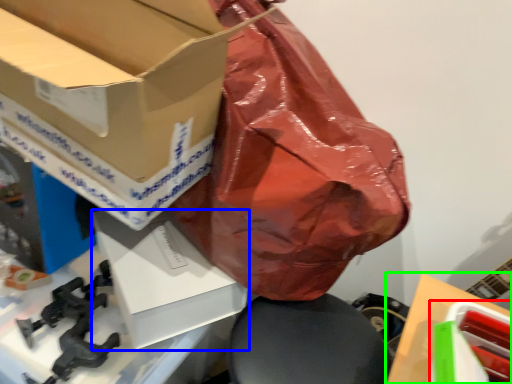
Question: Considering the real-world distances, which object is closest to box (highlighted by a red box)? box (highlighted by a blue box) or cardboard box (highlighted by a green box).

Choices:
 (A) box
 (B) cardboard box

Answer: (B)